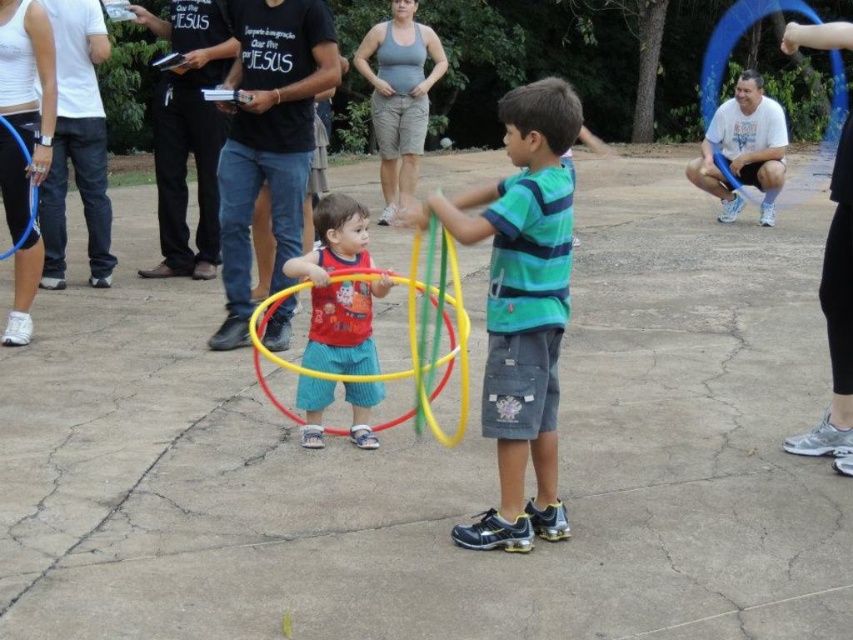
Is matte red hula hoop at center closer to camera compared to yellow plastic hula hoop at center?

No, it is behind yellow plastic hula hoop at center.

Can you confirm if matte red hula hoop at center is positioned above yellow plastic hula hoop at center?

Yes.

Between point (346, 257) and point (444, 371), which one is positioned behind?

Positioned behind is point (444, 371).

At what (x,y) coordinates should I click in order to perform the action: click on matte red hula hoop at center. Please return your answer as a coordinate pair (x, y). Looking at the image, I should click on (339, 289).

Does white cotton shirt at right have a greater height compared to yellow plastic hula hoop at center?

Yes.

Does point (782, 154) come behind point (461, 433)?

Yes, point (782, 154) is farther from viewer.

Where is `white cotton shirt at right`? white cotton shirt at right is located at coordinates (743, 148).

How far apart are green striped shirt at center and yellow plastic hula hoop at center?

green striped shirt at center is 30.43 inches from yellow plastic hula hoop at center.

Can you confirm if green striped shirt at center is shorter than yellow plastic hula hoop at center?

Incorrect, green striped shirt at center's height does not fall short of yellow plastic hula hoop at center's.

The image size is (853, 640). I want to click on green striped shirt at center, so click(521, 307).